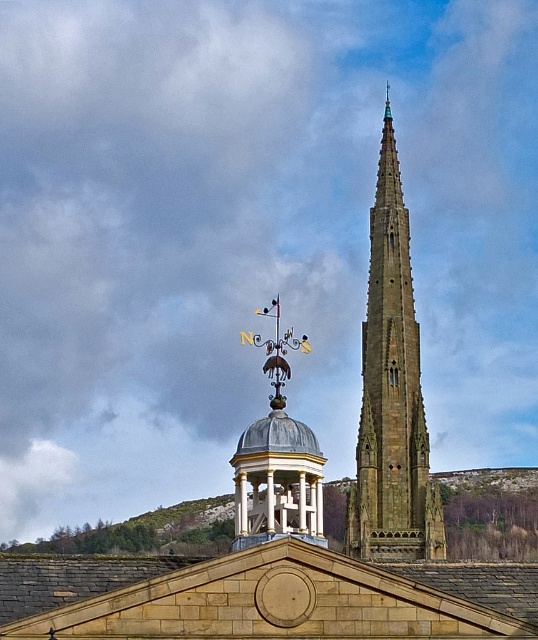
Question: Based on their relative distances, which object is farther from the metallic dome at center?

Choices:
 (A) brown stone roof at center
 (B) brown stone spire at center

Answer: (B)

Question: In this image, where is brown stone roof at center located relative to metallic dome at center?

Choices:
 (A) left
 (B) right

Answer: (B)

Question: Does brown stone roof at center appear on the left side of brown stone spire at center?

Choices:
 (A) no
 (B) yes

Answer: (B)

Question: Which object is positioned farthest from the brown stone roof at center?

Choices:
 (A) metallic dome at center
 (B) brown stone spire at center

Answer: (B)

Question: From the image, what is the correct spatial relationship of brown stone roof at center in relation to metallic dome at center?

Choices:
 (A) right
 (B) left

Answer: (A)

Question: Which of these objects is positioned closest to the brown stone spire at center?

Choices:
 (A) brown stone roof at center
 (B) metallic dome at center

Answer: (A)